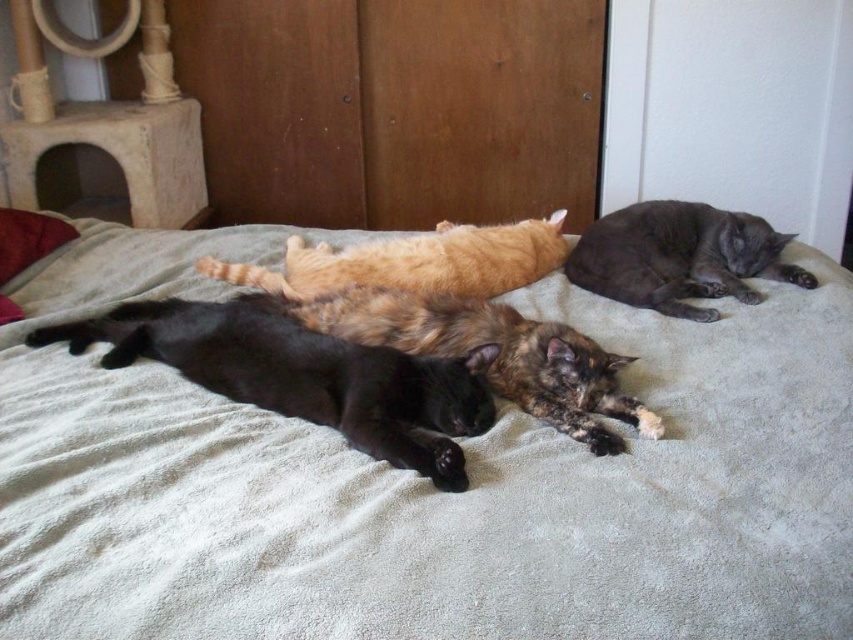
Question: Among these points, which one is farthest from the camera?

Choices:
 (A) (178, 324)
 (B) (792, 275)

Answer: (B)

Question: Which point is closer to the camera?

Choices:
 (A) velvety red pillow at left
 (B) black glossy cat at lower left
 (C) tortoiseshell fur cat at center
 (D) soft gray blanket at center

Answer: (D)

Question: Which is nearer to the shiny gray cat at upper right?

Choices:
 (A) soft gray blanket at center
 (B) black glossy cat at lower left

Answer: (A)

Question: Is shiny gray cat at upper right thinner than velvety red pillow at left?

Choices:
 (A) no
 (B) yes

Answer: (A)

Question: Does tortoiseshell fur cat at center have a lesser width compared to shiny gray cat at upper right?

Choices:
 (A) yes
 (B) no

Answer: (B)

Question: Does black glossy cat at lower left appear on the right side of tortoiseshell fur cat at center?

Choices:
 (A) no
 (B) yes

Answer: (A)